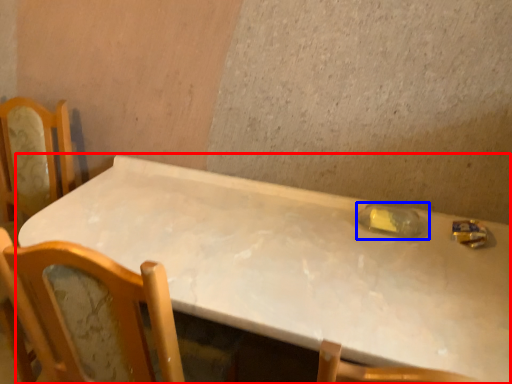
Question: Among these objects, which one is nearest to the camera, table (highlighted by a red box) or bottle (highlighted by a blue box)?

Choices:
 (A) table
 (B) bottle

Answer: (A)